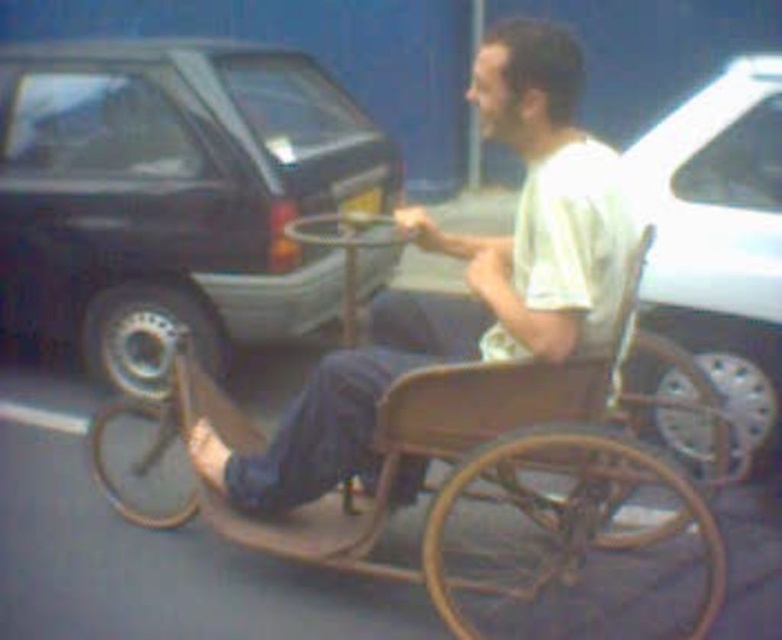
Between shiny black car at left and wooden wheelchair at center, which one appears on the right side from the viewer's perspective?

wooden wheelchair at center is more to the right.

Who is shorter, shiny black car at left or wooden wheelchair at center?

wooden wheelchair at center is shorter.

Who is more distant from viewer, [94,131] or [273,460]?

Positioned behind is point [94,131].

This screenshot has height=640, width=782. Find the location of `shiny black car at left`. shiny black car at left is located at coordinates (174, 195).

Is point (648, 524) positioned after point (293, 419)?

That is True.

The image size is (782, 640). What do you see at coordinates (472, 493) in the screenshot?
I see `rusty wood wagon at center` at bounding box center [472, 493].

Is point (567, 416) in front of point (537, 180)?

No, (567, 416) is further to viewer.

Where is `rusty wood wagon at center`? rusty wood wagon at center is located at coordinates (472, 493).

Who is higher up, rusty wood wagon at center or white glossy car at right?

white glossy car at right is higher up.

Who is positioned more to the left, rusty wood wagon at center or white glossy car at right?

rusty wood wagon at center is more to the left.

Which is behind, point (510, 392) or point (712, 184)?

Point (712, 184)

At what (x,y) coordinates should I click in order to perform the action: click on rusty wood wagon at center. Please return your answer as a coordinate pair (x, y). Looking at the image, I should click on (472, 493).